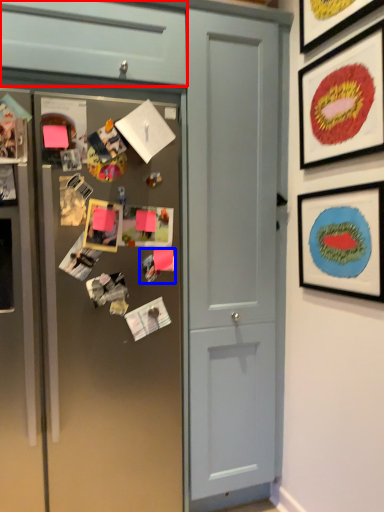
Question: Which object appears closest to the camera in this image, cabinetry (highlighted by a red box) or art (highlighted by a blue box)?

Choices:
 (A) cabinetry
 (B) art

Answer: (A)